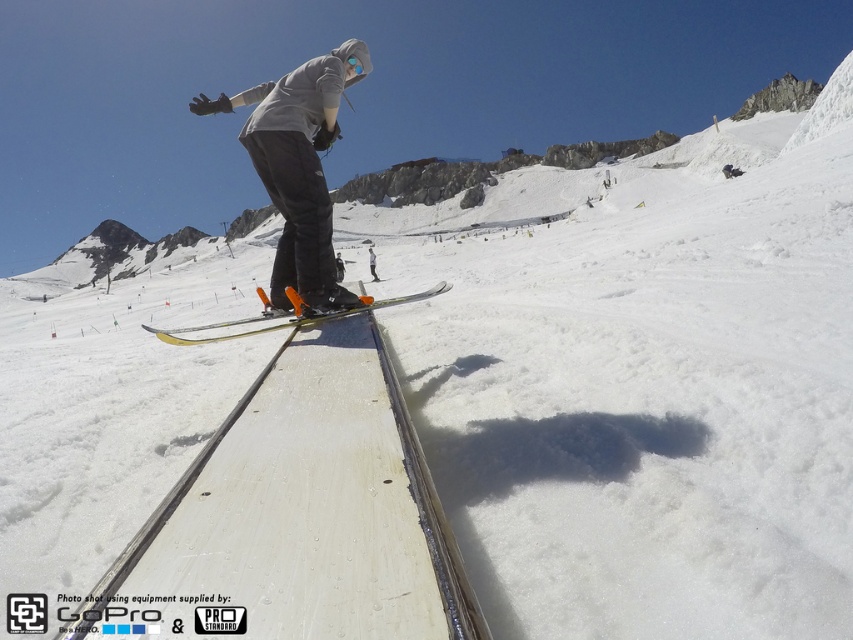
Question: Which of the following is the farthest from the observer?

Choices:
 (A) gray matte hoodie at center
 (B) yellow metallic skis at center

Answer: (A)

Question: Is gray matte hoodie at center above yellow metallic skis at center?

Choices:
 (A) yes
 (B) no

Answer: (A)

Question: Can you confirm if gray matte hoodie at center is bigger than yellow metallic skis at center?

Choices:
 (A) no
 (B) yes

Answer: (B)

Question: Which point is closer to the camera?

Choices:
 (A) click(x=206, y=340)
 (B) click(x=317, y=227)

Answer: (A)

Question: Which object appears farthest from the camera in this image?

Choices:
 (A) yellow metallic skis at center
 (B) gray matte hoodie at center

Answer: (B)

Question: Is gray matte hoodie at center closer to camera compared to yellow metallic skis at center?

Choices:
 (A) no
 (B) yes

Answer: (A)